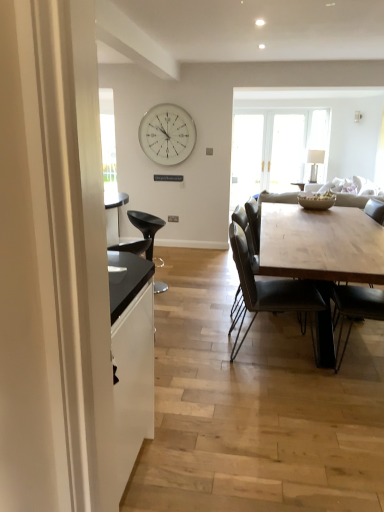
What is the approximate width of leather couch at center?

It is 2.06 meters.

The width and height of the screenshot is (384, 512). What do you see at coordinates (269, 293) in the screenshot?
I see `dark gray leather chair at center, the second chair positioned from the right` at bounding box center [269, 293].

Describe the element at coordinates (375, 210) in the screenshot. Image resolution: width=384 pixels, height=512 pixels. I see `black leather chair at center, which is the third chair from back to front` at that location.

You are a GUI agent. You are given a task and a screenshot of the screen. Output one action in this format:
    pyautogui.click(x=<x>, y=<y>)
    Task: Click on the natural wood table at center
    
    Given the screenshot: What is the action you would take?
    pyautogui.click(x=320, y=254)

From a real-world perspective, is clear glass table lamp at upper right above or below leather couch at center?

clear glass table lamp at upper right is above leather couch at center.

Considering the relative positions of clear glass table lamp at upper right and leather couch at center in the image provided, is clear glass table lamp at upper right behind leather couch at center?

Yes.

Can you confirm if clear glass table lamp at upper right is taller than leather couch at center?

No.

From the image's perspective, is clear glass table lamp at upper right under leather couch at center?

No, from the image's perspective, clear glass table lamp at upper right is not below leather couch at center.

Does black matte bar stool at left, the 1th chair viewed from the left, touch dark gray leather chair at center, marked as the second chair in a back-to-front arrangement?

There is a gap between black matte bar stool at left, the 1th chair viewed from the left, and dark gray leather chair at center, marked as the second chair in a back-to-front arrangement.

From a real-world perspective, is black matte bar stool at left, the 1th chair viewed from the left, located beneath dark gray leather chair at center, which is the second chair from left to right?

Yes.

Is black matte bar stool at left, the 1th chair viewed from the left, further to the viewer compared to dark gray leather chair at center, which is the second chair from left to right?

Yes.

From the image's perspective, is black matte bar stool at left, the 1th chair viewed from the left, located beneath dark gray leather chair at center, the second chair positioned from the right?

No, from the image's perspective, black matte bar stool at left, the 1th chair viewed from the left, is not below dark gray leather chair at center, the second chair positioned from the right.

Is white glass clock at upper center looking in the opposite direction of dark gray leather chair at center, the second chair positioned from the right?

No.

Based on the photo, which point is more distant from viewer, (174,153) or (304,284)?

The point (174,153) is behind.

Which is behind, white glass clock at upper center or dark gray leather chair at center, marked as the second chair in a back-to-front arrangement?

Positioned behind is white glass clock at upper center.

From the image's perspective, is white glass clock at upper center located beneath dark gray leather chair at center, the second chair in the front-to-back sequence?

No, from the image's perspective, white glass clock at upper center is not beneath dark gray leather chair at center, the second chair in the front-to-back sequence.

Is clear glass table lamp at upper right placed right next to natural wood table at center?

No, clear glass table lamp at upper right is not next to natural wood table at center.

In terms of width, does clear glass table lamp at upper right look wider or thinner when compared to natural wood table at center?

clear glass table lamp at upper right is thinner than natural wood table at center.

Is clear glass table lamp at upper right bigger than natural wood table at center?

No.

Would you say clear glass table lamp at upper right is outside natural wood table at center?

Yes, clear glass table lamp at upper right is not within natural wood table at center.

Would you say white glass clock at upper center is a long distance from natural wood table at center?

Yes, white glass clock at upper center is far from natural wood table at center.

Does white glass clock at upper center appear on the left side of natural wood table at center?

Indeed, white glass clock at upper center is positioned on the left side of natural wood table at center.

Considering the positions of point (154, 152) and point (306, 222), is point (154, 152) closer or farther from the camera than point (306, 222)?

Point (154, 152) is positioned farther from the camera compared to point (306, 222).

Which object is thinner, white glass clock at upper center or natural wood table at center?

Thinner between the two is white glass clock at upper center.

Is there a large distance between natural wood table at center and dark gray leather chair at center, the second chair positioned from the right?

No, there isn't a large distance between natural wood table at center and dark gray leather chair at center, the second chair positioned from the right.

From the image's perspective, between natural wood table at center and dark gray leather chair at center, which is the second chair from left to right, which one is located above?

natural wood table at center, from the image's perspective.

Is natural wood table at center to the left or to the right of dark gray leather chair at center, which is the second chair from left to right, in the image?

From the image, it's evident that natural wood table at center is to the right of dark gray leather chair at center, which is the second chair from left to right.

Could you measure the distance between black leather chair at center, marked as the third chair in a left-to-right arrangement, and clear glass table lamp at upper right?

black leather chair at center, marked as the third chair in a left-to-right arrangement, is 2.01 meters from clear glass table lamp at upper right.

Can you tell me how much black leather chair at center, marked as the third chair in a left-to-right arrangement, and clear glass table lamp at upper right differ in facing direction?

The facing directions of black leather chair at center, marked as the third chair in a left-to-right arrangement, and clear glass table lamp at upper right are 6.92 degrees apart.

The height and width of the screenshot is (512, 384). I want to click on chair that is the 1st object directly below the clear glass table lamp at upper right (from a real-world perspective), so click(375, 210).

Is point (367, 201) positioned in front of point (311, 176)?

Yes, point (367, 201) is in front of point (311, 176).

This screenshot has height=512, width=384. I want to click on lamp above the leather couch at center (from the image's perspective), so click(x=315, y=163).

In the image, there is a dark gray leather chair at center, the second chair in the front-to-back sequence. Where is `chair below it (from a real-world perspective)`? chair below it (from a real-world perspective) is located at coordinates (146, 227).

Which object lies nearer to the anchor point dark gray leather chair at center, the second chair positioned from the right, black matte bar stool at left, the third chair viewed from the right, or black leather chair at center, which is the third chair from back to front?

black matte bar stool at left, the third chair viewed from the right, lies closer to dark gray leather chair at center, the second chair positioned from the right, than the other object.

Considering their positions, is natural wood table at center positioned further to clear glass table lamp at upper right than white glass clock at upper center?

natural wood table at center lies further to clear glass table lamp at upper right than the other object.

Estimate the real-world distances between objects in this image. Which object is closer to natural wood table at center, white glass clock at upper center or black leather chair at center, which is the third chair from back to front?

Based on the image, black leather chair at center, which is the third chair from back to front, appears to be nearer to natural wood table at center.

Looking at the image, which one is located further to white glass clock at upper center, black matte bar stool at left, the 1th chair viewed from the left, or natural wood table at center?

natural wood table at center.

Which object lies nearer to the anchor point clear glass table lamp at upper right, black leather chair at center, the first chair positioned from the front, or leather couch at center?

The object closer to clear glass table lamp at upper right is leather couch at center.

Estimate the real-world distances between objects in this image. Which object is closer to white glass clock at upper center, black leather chair at center, the first chair positioned from the front, or natural wood table at center?

natural wood table at center lies closer to white glass clock at upper center than the other object.

Based on their spatial positions, is leather couch at center or clear glass table lamp at upper right further from black leather chair at center, marked as the 1th chair in a right-to-left arrangement?

Among the two, clear glass table lamp at upper right is located further to black leather chair at center, marked as the 1th chair in a right-to-left arrangement.

Which object lies further to the anchor point clear glass table lamp at upper right, black matte bar stool at left, the third chair viewed from the right, or white glass clock at upper center?

black matte bar stool at left, the third chair viewed from the right, is positioned further to the anchor clear glass table lamp at upper right.

This screenshot has width=384, height=512. Identify the location of chair between black matte bar stool at left, which appears as the first chair when viewed from the back, and black leather chair at center, which is the third chair from back to front, in the horizontal direction. (269, 293).

Locate an element on the screen. couch between natural wood table at center and clear glass table lamp at upper right along the z-axis is located at coordinates (356, 198).

Image resolution: width=384 pixels, height=512 pixels. I want to click on couch between dark gray leather chair at center, the second chair in the front-to-back sequence, and clear glass table lamp at upper right, along the z-axis, so click(356, 198).

The height and width of the screenshot is (512, 384). Identify the location of clock between leather couch at center and clear glass table lamp at upper right in the front-back direction. (167, 134).